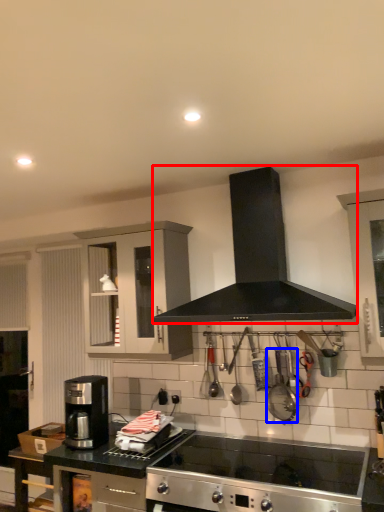
Question: Which object appears farthest to the camera in this image, kitchen appliance (highlighted by a red box) or appliance (highlighted by a blue box)?

Choices:
 (A) kitchen appliance
 (B) appliance

Answer: (B)